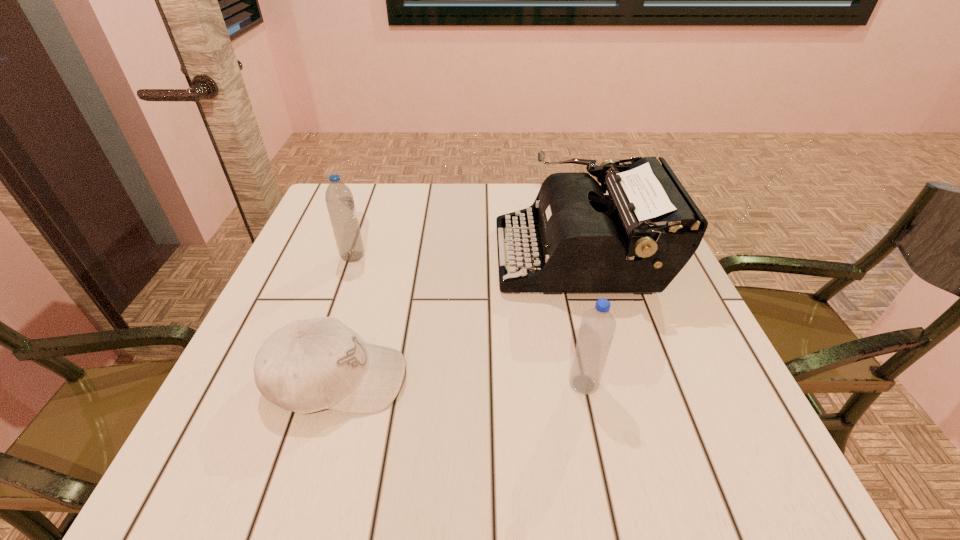
I want to click on object located at the far edge, so click(x=637, y=238).

Where is `water bottle at the left edge`? This screenshot has width=960, height=540. water bottle at the left edge is located at coordinates (339, 199).

Locate an element on the screen. This screenshot has width=960, height=540. baseball cap present at the left edge is located at coordinates (308, 365).

The height and width of the screenshot is (540, 960). I want to click on object at the right edge, so click(x=637, y=238).

What are the coordinates of `object positioned at the far right corner` in the screenshot? It's located at (637, 238).

In the image, there is a desktop. Where is `blank space at the far edge`? This screenshot has width=960, height=540. blank space at the far edge is located at coordinates (447, 216).

In the image, there is a desktop. At what (x,y) coordinates should I click in order to perform the action: click on blank space at the near edge. Please return your answer as a coordinate pair (x, y). This screenshot has width=960, height=540. Looking at the image, I should click on (356, 446).

This screenshot has height=540, width=960. In order to click on vacant area at the left edge of the desktop in this screenshot , I will do `click(300, 277)`.

The image size is (960, 540). Find the location of `vacant space at the right edge`. vacant space at the right edge is located at coordinates (654, 353).

I want to click on vacant space at the far left corner of the desktop, so click(x=357, y=199).